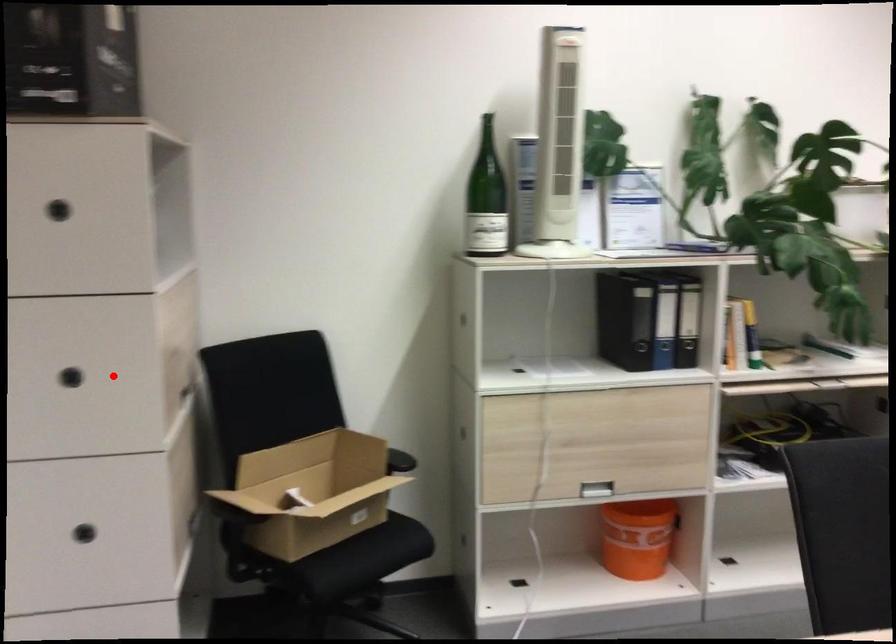
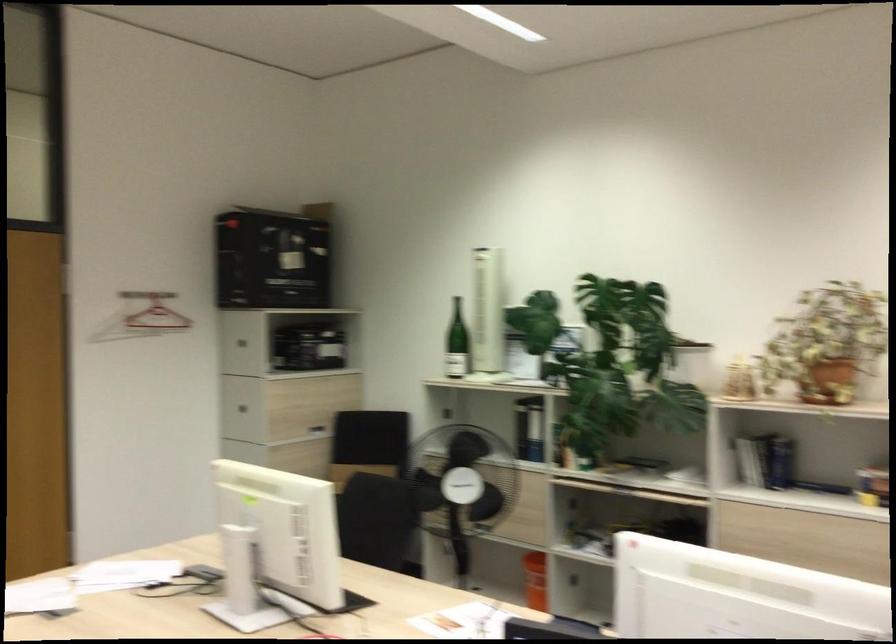
The point at the highlighted location is marked in the first image. Where is the corresponding point in the second image?

(244, 402)